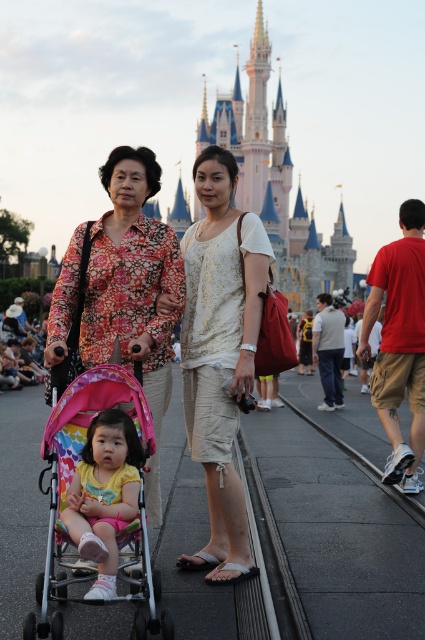
Question: Does white cotton dress at center appear on the right side of floral fabric dress at center?

Choices:
 (A) no
 (B) yes

Answer: (B)

Question: Which object is positioned farthest from the pastel pink fabric stroller at center?

Choices:
 (A) white cotton dress at center
 (B) floral fabric dress at center
 (C) multicolored fabric baby carriage at center

Answer: (A)

Question: Which object appears farthest from the camera in this image?

Choices:
 (A) multicolored fabric baby carriage at center
 (B) pastel pink fabric stroller at center
 (C) floral fabric dress at center

Answer: (C)

Question: Which of the following is the closest to the observer?

Choices:
 (A) multicolored fabric baby carriage at center
 (B) floral fabric dress at center

Answer: (A)

Question: Is floral fabric dress at center bigger than multicolored fabric baby carriage at center?

Choices:
 (A) yes
 (B) no

Answer: (A)

Question: Does white cotton dress at center appear on the right side of floral fabric dress at center?

Choices:
 (A) yes
 (B) no

Answer: (A)